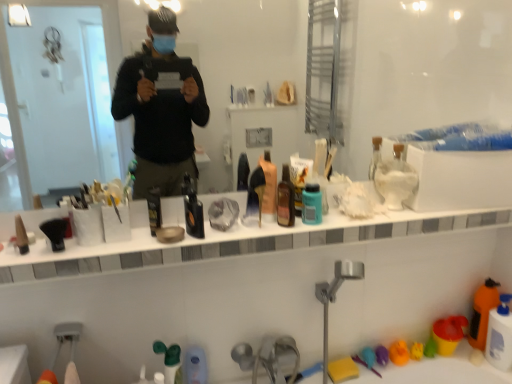
Question: Is white glossy counter top at center bigger or smaller than translucent plastic bottle at lower right, the first cleaning product in the bottom-to-top sequence?

Choices:
 (A) small
 (B) big

Answer: (B)

Question: Considering the positions of white glossy counter top at center and translucent plastic bottle at lower right, the third cleaning product in the left-to-right sequence, in the image, is white glossy counter top at center taller or shorter than translucent plastic bottle at lower right, the third cleaning product in the left-to-right sequence,?

Choices:
 (A) short
 (B) tall

Answer: (A)

Question: Estimate the real-world distances between objects in this image. Which object is closer to the brown glass bottle at center, the second mouthwash in the left-to-right sequence?

Choices:
 (A) translucent plastic bottle at lower center, which ranks as the fourth toiletry in top-to-bottom order
 (B) yellow rubber duck at lower right, the first toy viewed from the right
 (C) white glossy counter top at center
 (D) teal matte bottle at center, which ranks as the 1th mouthwash in right-to-left order
 (E) black matte bottle at center

Answer: (D)

Question: Which object is the closest to the black matte bottle at center?

Choices:
 (A) translucent plastic bottle at lower center, the 1th toiletry in the back-to-front sequence
 (B) black matte bottle at center, which ranks as the third mouthwash in right-to-left order
 (C) translucent plastic bottle at lower right, which is the 3th cleaning product from top to bottom
 (D) transparent glass mirror at upper center
 (E) brown glass bottle at center, the second mouthwash in the left-to-right sequence

Answer: (D)